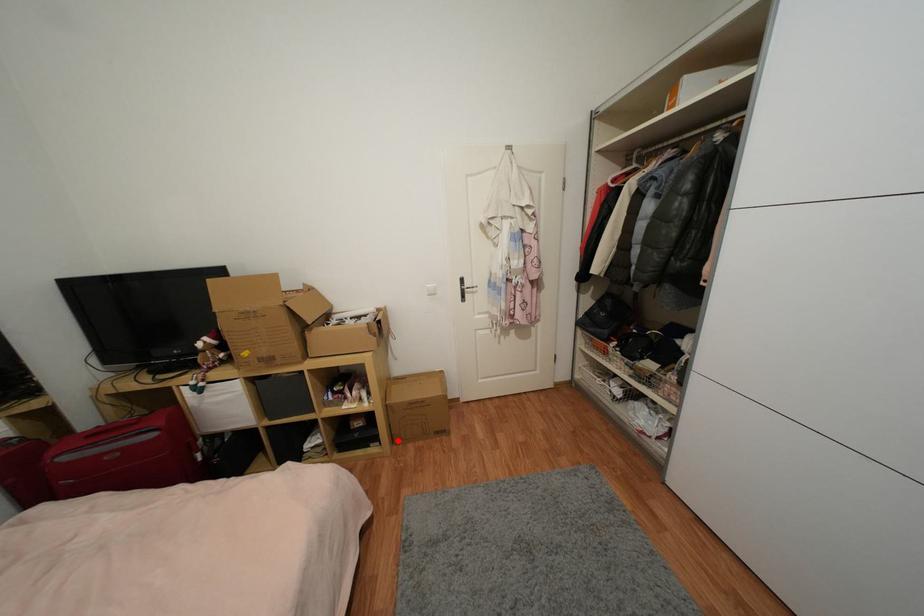
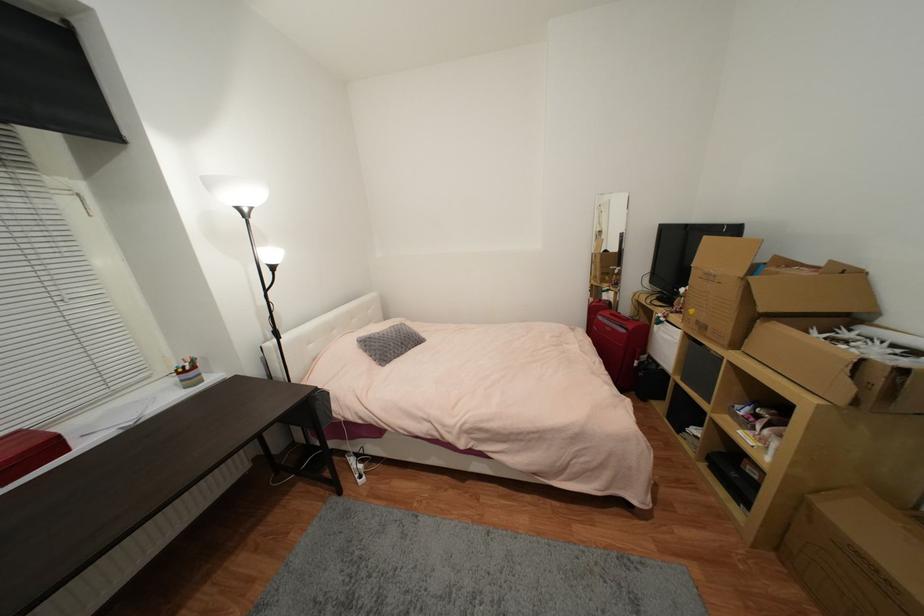
Find the pixel in the second image that matches the highlighted location in the first image.

(782, 546)